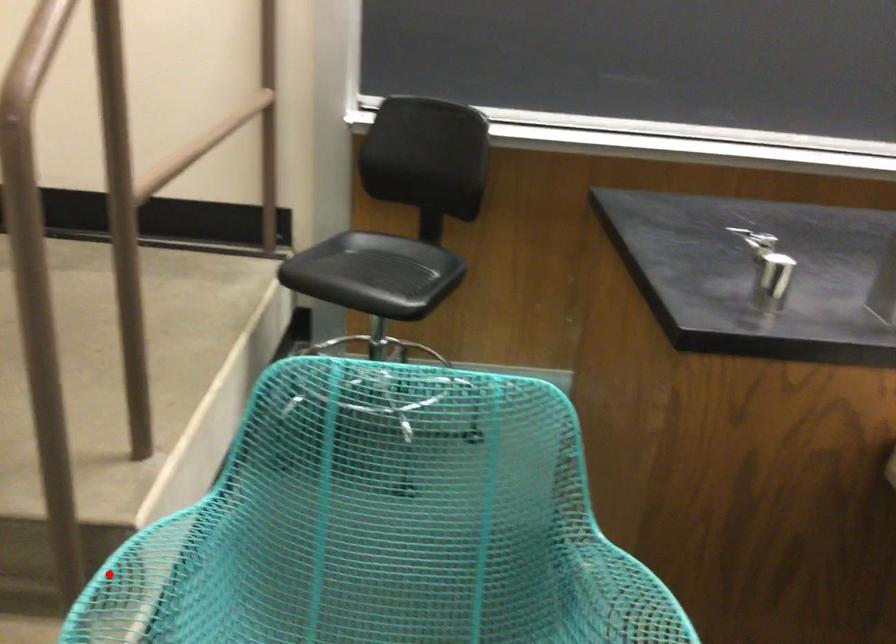
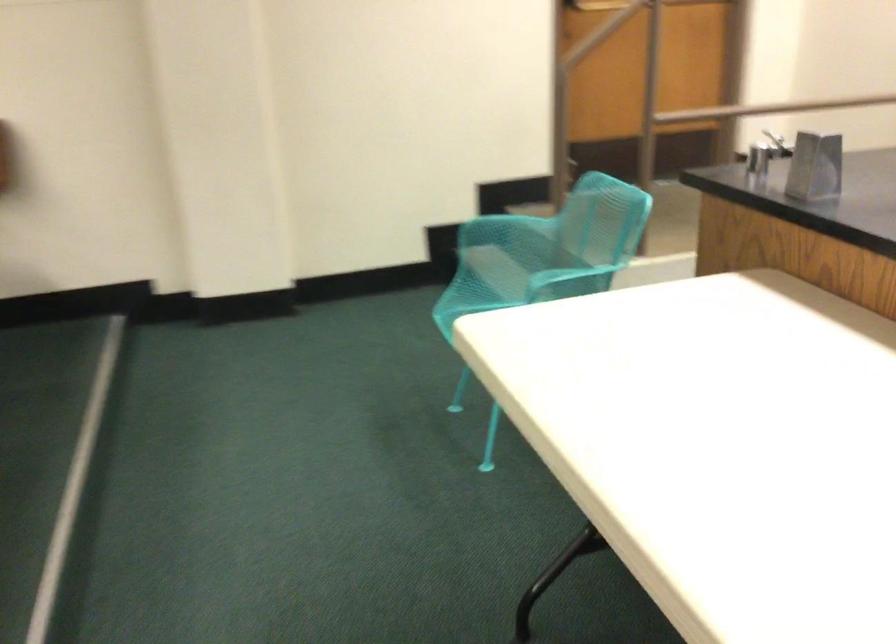
Question: I am providing you with two images of the same scene from different viewpoints. Image1 has a red point marked. In image2, the corresponding 3D location appears at what relative position? Reply with the corresponding letter.

Choices:
 (A) Closer
 (B) Farther

Answer: (B)